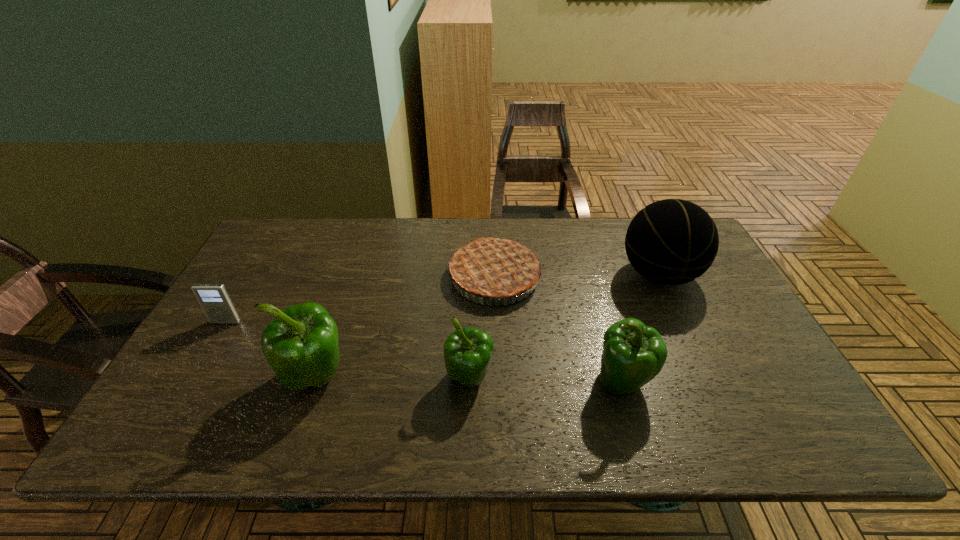
The width and height of the screenshot is (960, 540). What are the coordinates of `the leftmost bell pepper` in the screenshot? It's located at (301, 344).

What are the coordinates of `the second bell pepper from right to left` in the screenshot? It's located at (467, 352).

Locate an element on the screen. This screenshot has height=540, width=960. the second tallest bell pepper is located at coordinates (633, 354).

Locate an element on the screen. The image size is (960, 540). the rightmost bell pepper is located at coordinates (633, 354).

I want to click on iPod, so click(214, 299).

You are a GUI agent. You are given a task and a screenshot of the screen. Output one action in this format:
    pyautogui.click(x=<x>, y=<y>)
    Task: Click on the third farthest object
    The image size is (960, 540).
    Given the screenshot: What is the action you would take?
    pyautogui.click(x=214, y=299)

I want to click on the rightmost object, so click(x=670, y=242).

Find the location of a particular element. The image size is (960, 540). pie is located at coordinates (492, 268).

Locate an element on the screen. The image size is (960, 540). vacant point located on the right of the leftmost bell pepper is located at coordinates (455, 376).

Locate an element on the screen. Image resolution: width=960 pixels, height=540 pixels. vacant point located 0.320m on the right of the second bell pepper from left to right is located at coordinates (627, 379).